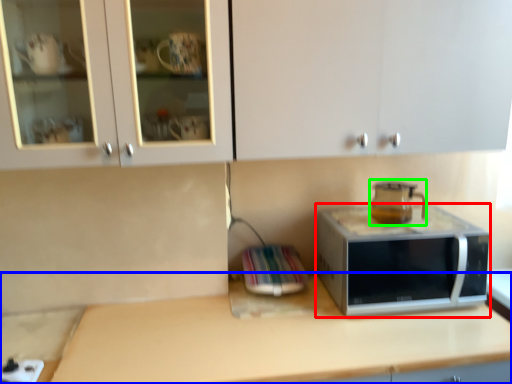
Question: Which object is the closest to the microwave oven (highlighted by a red box)? Choose among these: countertop (highlighted by a blue box) or coffeepot (highlighted by a green box).

Choices:
 (A) countertop
 (B) coffeepot

Answer: (B)